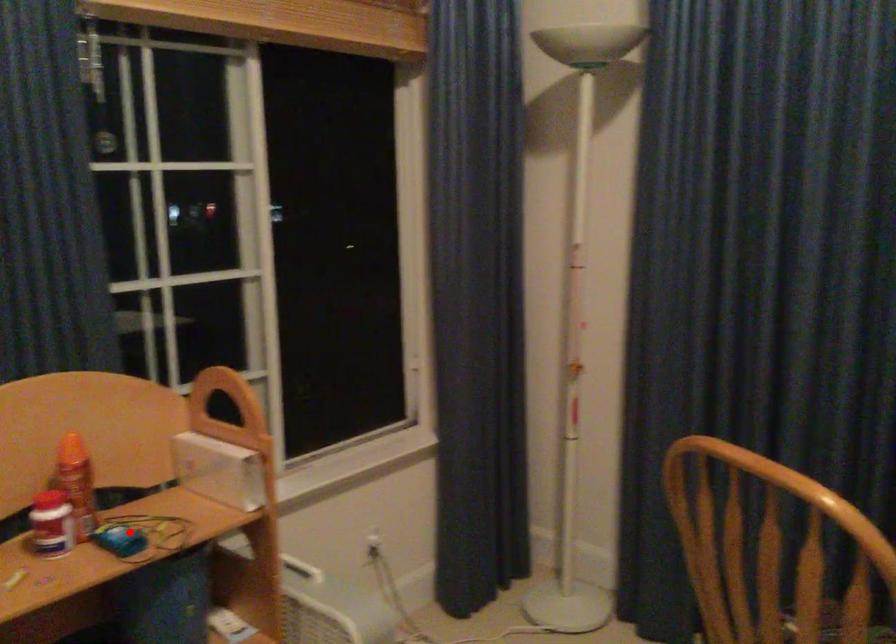
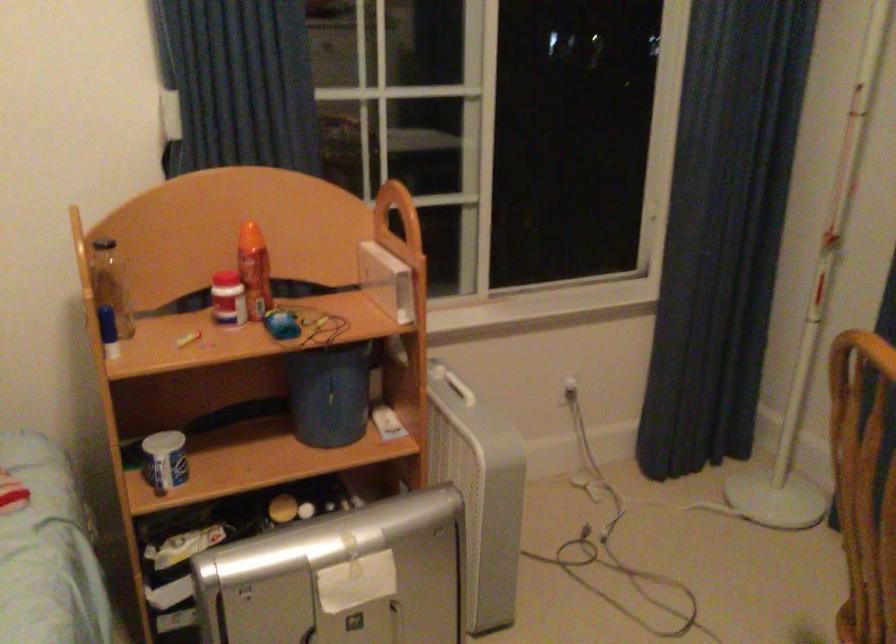
Where in the second image is the point corresponding to the highlighted location from the first image?

(281, 324)